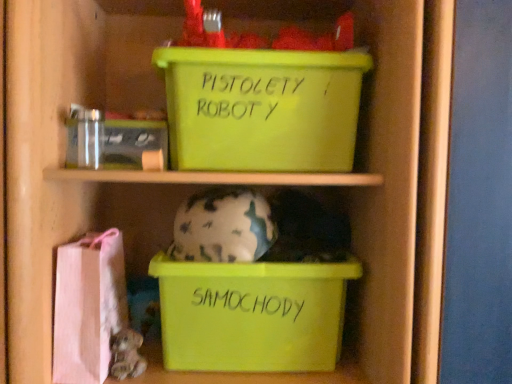
Question: Does green plastic storage box at upper center, positioned as the third storage box in bottom-to-top order, touch clear plastic jar at upper left, the second storage box viewed from the top?

Choices:
 (A) yes
 (B) no

Answer: (B)

Question: Can you confirm if green plastic storage box at upper center, placed as the 1th storage box when sorted from top to bottom, is thinner than clear plastic jar at upper left, the second storage box viewed from the top?

Choices:
 (A) yes
 (B) no

Answer: (B)

Question: Is green plastic storage box at upper center, placed as the 1th storage box when sorted from top to bottom, in front of clear plastic jar at upper left, acting as the second storage box starting from the bottom?

Choices:
 (A) yes
 (B) no

Answer: (A)

Question: From the image's perspective, is green plastic storage box at upper center, positioned as the third storage box in bottom-to-top order, below clear plastic jar at upper left, the second storage box viewed from the top?

Choices:
 (A) no
 (B) yes

Answer: (A)

Question: Is green plastic storage box at upper center, placed as the 1th storage box when sorted from top to bottom, bigger than clear plastic jar at upper left, the second storage box viewed from the top?

Choices:
 (A) no
 (B) yes

Answer: (B)

Question: Does green plastic storage box at upper center, placed as the 1th storage box when sorted from top to bottom, contain clear plastic jar at upper left, acting as the second storage box starting from the bottom?

Choices:
 (A) yes
 (B) no

Answer: (B)

Question: From a real-world perspective, does green plastic storage box at upper center, placed as the 1th storage box when sorted from top to bottom, sit lower than camouflage-patterned ceramic piggy bank at center?

Choices:
 (A) yes
 (B) no

Answer: (B)

Question: Can you confirm if green plastic storage box at upper center, placed as the 1th storage box when sorted from top to bottom, is bigger than camouflage-patterned ceramic piggy bank at center?

Choices:
 (A) no
 (B) yes

Answer: (B)

Question: Is green plastic storage box at upper center, positioned as the third storage box in bottom-to-top order, turned away from camouflage-patterned ceramic piggy bank at center?

Choices:
 (A) yes
 (B) no

Answer: (B)

Question: Considering the relative sizes of green plastic storage box at upper center, positioned as the third storage box in bottom-to-top order, and camouflage-patterned ceramic piggy bank at center in the image provided, is green plastic storage box at upper center, positioned as the third storage box in bottom-to-top order, shorter than camouflage-patterned ceramic piggy bank at center?

Choices:
 (A) no
 (B) yes

Answer: (A)

Question: Is green plastic storage box at upper center, placed as the 1th storage box when sorted from top to bottom, not near camouflage-patterned ceramic piggy bank at center?

Choices:
 (A) yes
 (B) no

Answer: (B)

Question: Is green plastic storage box at upper center, placed as the 1th storage box when sorted from top to bottom, further to camera compared to camouflage-patterned ceramic piggy bank at center?

Choices:
 (A) no
 (B) yes

Answer: (B)

Question: Is pink fabric bag at lower left completely or partially inside green plastic storage box at upper center, positioned as the third storage box in bottom-to-top order?

Choices:
 (A) yes
 (B) no

Answer: (B)